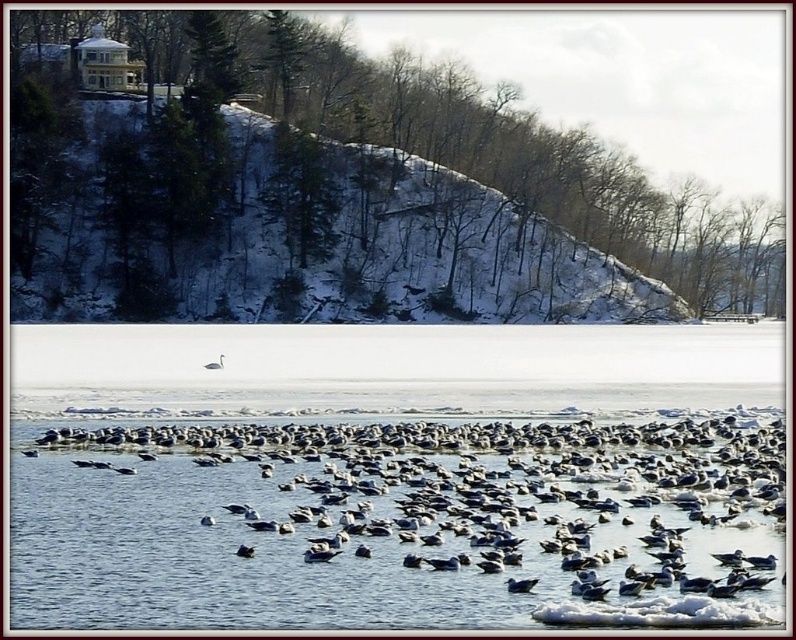
Question: Can you confirm if white matte swan at center is wider than white matte duck at center?

Choices:
 (A) yes
 (B) no

Answer: (A)

Question: Can you confirm if white matte bird at center is thinner than white matte swan at center?

Choices:
 (A) no
 (B) yes

Answer: (B)

Question: Which object appears farthest from the camera in this image?

Choices:
 (A) white matte seagulls at center
 (B) white matte swan at center
 (C) white matte bird at center
 (D) white matte duck at center

Answer: (B)

Question: Which point is closer to the camera taking this photo?

Choices:
 (A) coord(203,365)
 (B) coord(510,588)

Answer: (B)

Question: Which object is positioned farthest from the white matte duck at center?

Choices:
 (A) white matte seagulls at center
 (B) white matte bird at center
 (C) white matte swan at center

Answer: (C)

Question: Can you confirm if white matte seagulls at center is bigger than white matte swan at center?

Choices:
 (A) yes
 (B) no

Answer: (A)